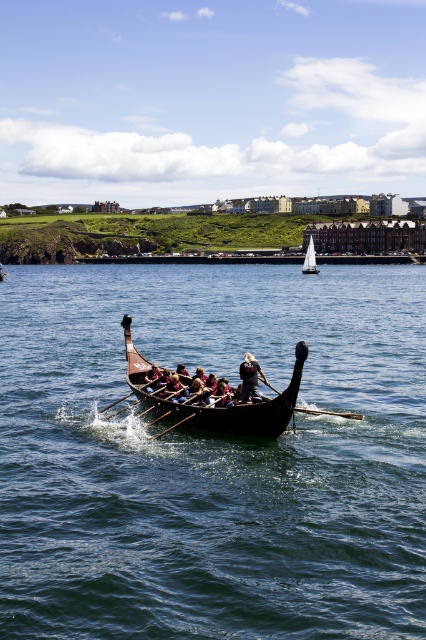
At what (x,y) coordinates should I click in order to perform the action: click on white sailboat at upper center. Please return your answer as a coordinate pair (x, y). Looking at the image, I should click on (310, 259).

Does white sailboat at upper center come in front of wooden at center?

No, white sailboat at upper center is further to the viewer.

Find the location of a particular element. This screenshot has width=426, height=640. white sailboat at upper center is located at coordinates (310, 259).

Find the location of a particular element. white sailboat at upper center is located at coordinates (310, 259).

Looking at this image, does dark brown leather helmet at center have a larger size compared to wooden at center?

Yes.

Is point (245, 387) behind point (213, 404)?

No, it is in front of (213, 404).

Where is `dark brown leather helmet at center`? The height and width of the screenshot is (640, 426). dark brown leather helmet at center is located at coordinates (250, 378).

Can you confirm if dark blue water at center is positioned to the left of wooden at center?

Incorrect, dark blue water at center is not on the left side of wooden at center.

In the scene shown: Is dark blue water at center bigger than wooden at center?

Yes.

This screenshot has height=640, width=426. Describe the element at coordinates (212, 456) in the screenshot. I see `dark blue water at center` at that location.

Locate an element on the screen. This screenshot has width=426, height=640. dark blue water at center is located at coordinates (212, 456).